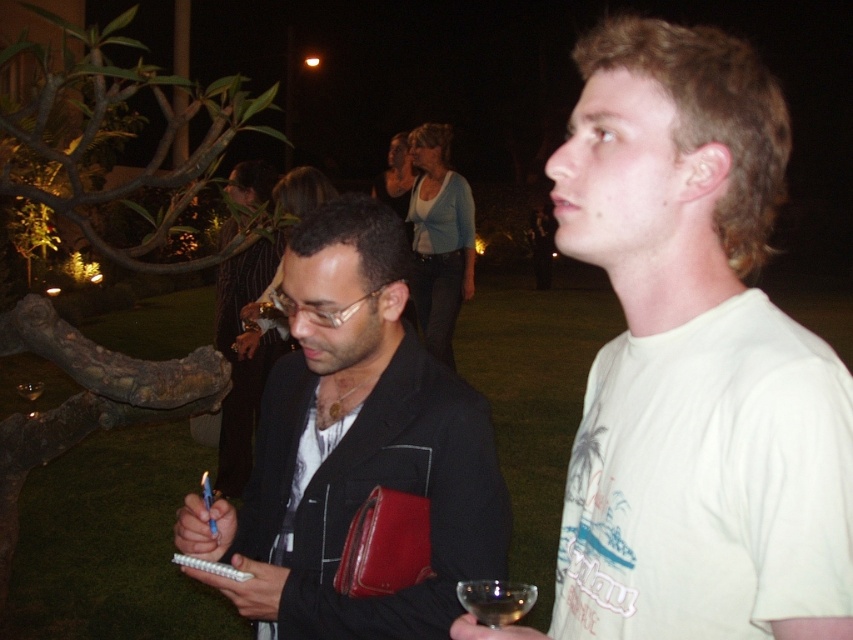
Question: Can you confirm if white cotton t-shirt at center is positioned below clear glass at lower center?

Choices:
 (A) yes
 (B) no

Answer: (B)

Question: Which of the following is the closest to the observer?

Choices:
 (A) (456, 589)
 (B) (631, 326)

Answer: (B)

Question: Does black leather jacket at center have a greater width compared to clear glass at lower center?

Choices:
 (A) no
 (B) yes

Answer: (B)

Question: Considering the real-world distances, which object is farthest from the clear glass at lower center?

Choices:
 (A) white cotton t-shirt at center
 (B) black leather jacket at center

Answer: (B)

Question: Which of the following is the closest to the observer?

Choices:
 (A) black leather jacket at center
 (B) white cotton t-shirt at center

Answer: (B)

Question: Does black leather jacket at center lie in front of clear glass at lower center?

Choices:
 (A) yes
 (B) no

Answer: (B)